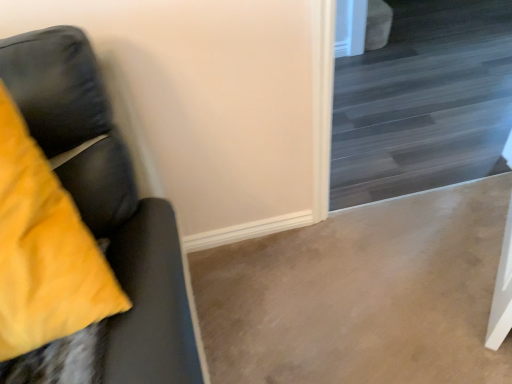
The height and width of the screenshot is (384, 512). I want to click on matte black couch at left, so click(x=108, y=203).

Measure the distance between point (95,180) and camera.

36.30 inches.

What is the approximate width of matte black couch at left?

It is 10.83 inches.

The width and height of the screenshot is (512, 384). Describe the element at coordinates (108, 203) in the screenshot. I see `matte black couch at left` at that location.

What is the approximate width of dark wood stairs at upper right?

dark wood stairs at upper right is 9.41 inches in width.

Image resolution: width=512 pixels, height=384 pixels. Describe the element at coordinates (424, 102) in the screenshot. I see `dark wood stairs at upper right` at that location.

The width and height of the screenshot is (512, 384). What are the coordinates of `dark wood stairs at upper right` in the screenshot? It's located at (424, 102).

Identify the location of matte black couch at left. The width and height of the screenshot is (512, 384). (108, 203).

Considering the positions of objects dark wood stairs at upper right and matte black couch at left in the image provided, who is more to the right, dark wood stairs at upper right or matte black couch at left?

From the viewer's perspective, dark wood stairs at upper right appears more on the right side.

Is the position of dark wood stairs at upper right less distant than that of matte black couch at left?

That is False.

Which is behind, point (468, 158) or point (169, 375)?

Point (468, 158)

From the image's perspective, which object appears higher, dark wood stairs at upper right or matte black couch at left?

dark wood stairs at upper right appears higher in the image.

From a real-world perspective, is dark wood stairs at upper right under matte black couch at left?

Yes, from a real-world perspective, dark wood stairs at upper right is beneath matte black couch at left.

Considering the sizes of objects dark wood stairs at upper right and matte black couch at left in the image provided, who is thinner, dark wood stairs at upper right or matte black couch at left?

Thinner between the two is dark wood stairs at upper right.

Is dark wood stairs at upper right taller than matte black couch at left?

Correct, dark wood stairs at upper right is much taller as matte black couch at left.

In terms of size, does dark wood stairs at upper right appear bigger or smaller than matte black couch at left?

Considering their sizes, dark wood stairs at upper right takes up more space than matte black couch at left.

Choose the correct answer: Is dark wood stairs at upper right inside matte black couch at left or outside it?

dark wood stairs at upper right exists outside the volume of matte black couch at left.

Is dark wood stairs at upper right next to matte black couch at left and touching it?

No, dark wood stairs at upper right is not beside matte black couch at left.

Is matte black couch at left at the back of dark wood stairs at upper right?

No, matte black couch at left is not at the back of dark wood stairs at upper right.

Identify the location of furniture on the left of dark wood stairs at upper right. (108, 203).

Is matte black couch at left at the right side of dark wood stairs at upper right?

In fact, matte black couch at left is to the left of dark wood stairs at upper right.

Considering their positions, is matte black couch at left located in front of or behind dark wood stairs at upper right?

In the image, matte black couch at left appears in front of dark wood stairs at upper right.

Considering the points (153, 211) and (469, 102), which point is in front, point (153, 211) or point (469, 102)?

The point (153, 211) is in front.

From the image's perspective, which one is positioned lower, matte black couch at left or dark wood stairs at upper right?

matte black couch at left, from the image's perspective.

From a real-world perspective, between matte black couch at left and dark wood stairs at upper right, who is vertically higher?

matte black couch at left.

Between matte black couch at left and dark wood stairs at upper right, which one has larger width?

Answer: Wider between the two is matte black couch at left.

Does matte black couch at left have a greater height compared to dark wood stairs at upper right?

No.

Can you confirm if matte black couch at left is smaller than dark wood stairs at upper right?

Indeed, matte black couch at left has a smaller size compared to dark wood stairs at upper right.

Can dark wood stairs at upper right be found inside matte black couch at left?

No, dark wood stairs at upper right is not a part of matte black couch at left.

Is matte black couch at left next to dark wood stairs at upper right and touching it?

No, matte black couch at left is not with dark wood stairs at upper right.

In the scene shown: Could you tell me if matte black couch at left is turned towards dark wood stairs at upper right?

No, matte black couch at left does not turn towards dark wood stairs at upper right.

How many degrees apart are the facing directions of matte black couch at left and dark wood stairs at upper right?

15.8 degrees separate the facing orientations of matte black couch at left and dark wood stairs at upper right.

At what (x,y) coordinates should I click in order to perform the action: click on furniture positioned vertically above the dark wood stairs at upper right (from a real-world perspective). Please return your answer as a coordinate pair (x, y). This screenshot has height=384, width=512. Looking at the image, I should click on (108, 203).

The height and width of the screenshot is (384, 512). I want to click on furniture in front of the dark wood stairs at upper right, so click(108, 203).

Identify the location of furniture that is on the left side of dark wood stairs at upper right. (108, 203).